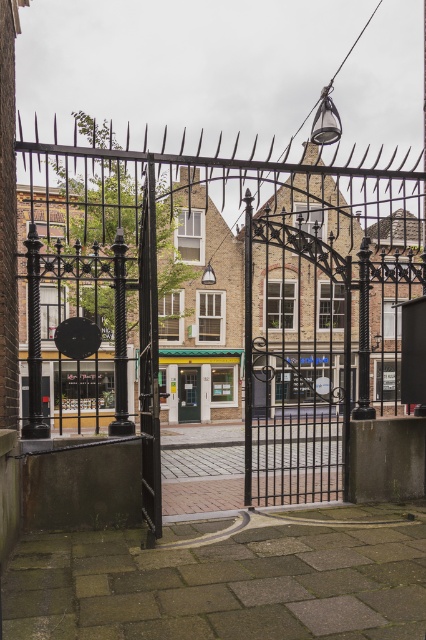
Does point (100, 268) come behind point (178, 392)?

No, (100, 268) is closer to viewer.

The width and height of the screenshot is (426, 640). Identify the location of black wrought iron gate at center. (259, 298).